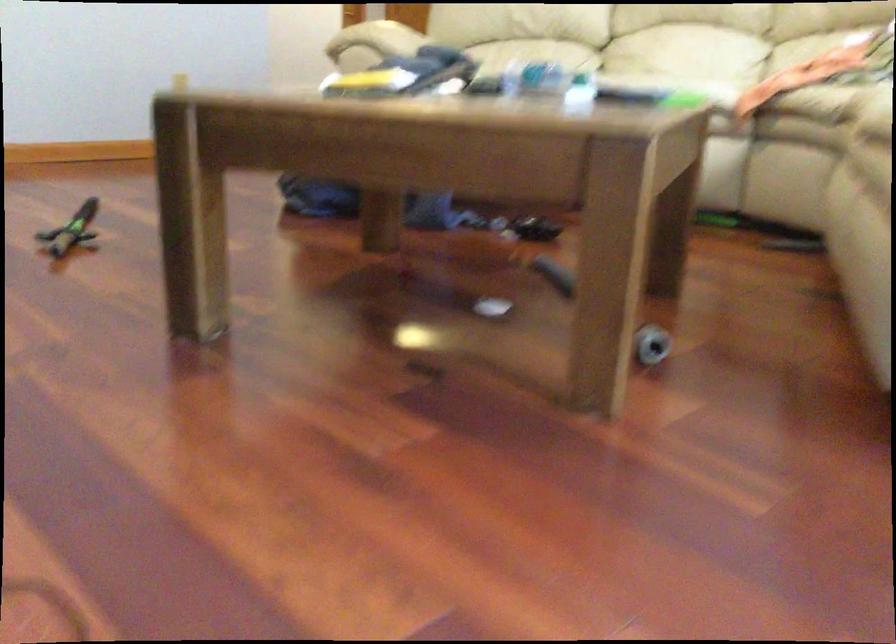
What are the coordinates of `grey cylindrical object` in the screenshot? It's located at (651, 345).